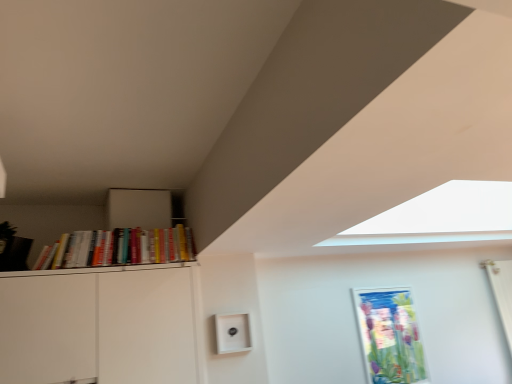
Question: Is metallic silver picture frame at center-right wider or thinner than hardcover books at left?

Choices:
 (A) wide
 (B) thin

Answer: (B)

Question: Visually, is metallic silver picture frame at center-right positioned to the left or to the right of hardcover books at left?

Choices:
 (A) right
 (B) left

Answer: (A)

Question: Based on their sizes in the image, would you say metallic silver picture frame at center-right is bigger or smaller than hardcover books at left?

Choices:
 (A) small
 (B) big

Answer: (A)

Question: From the image's perspective, relative to metallic silver picture frame at center-right, is hardcover books at left above or below?

Choices:
 (A) below
 (B) above

Answer: (B)

Question: Looking at their shapes, would you say hardcover books at left is wider or thinner than metallic silver picture frame at center-right?

Choices:
 (A) thin
 (B) wide

Answer: (B)

Question: Considering their positions, is hardcover books at left located in front of or behind metallic silver picture frame at center-right?

Choices:
 (A) front
 (B) behind

Answer: (A)

Question: Is point (168, 254) positioned closer to the camera than point (374, 294)?

Choices:
 (A) farther
 (B) closer

Answer: (B)